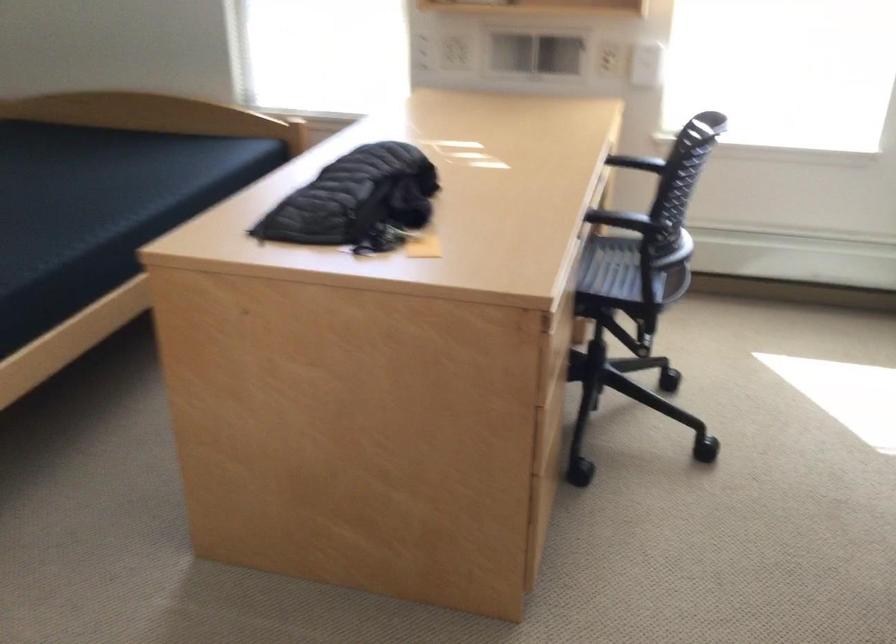
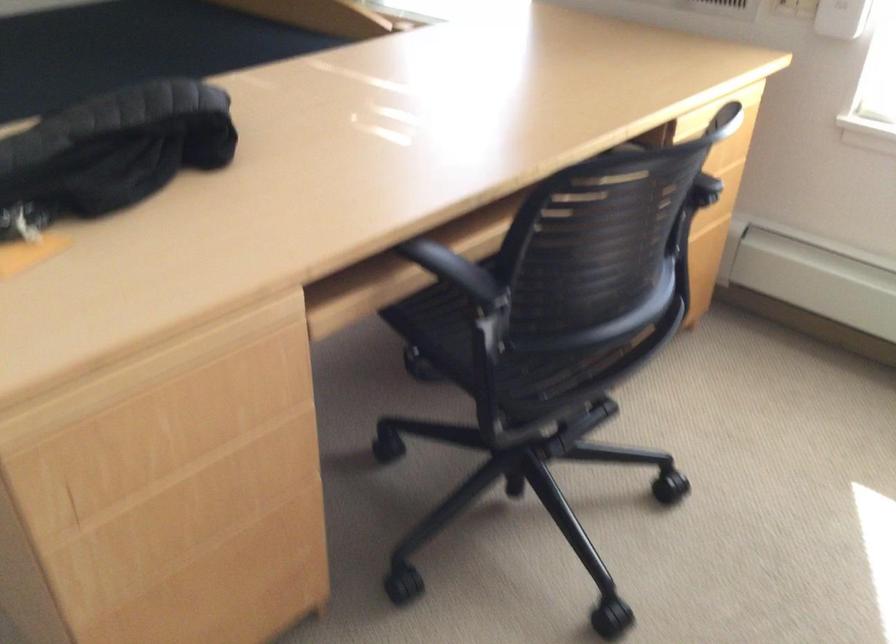
What movement of the cameraman would produce the second image?

The cameraman moved toward right, forward.